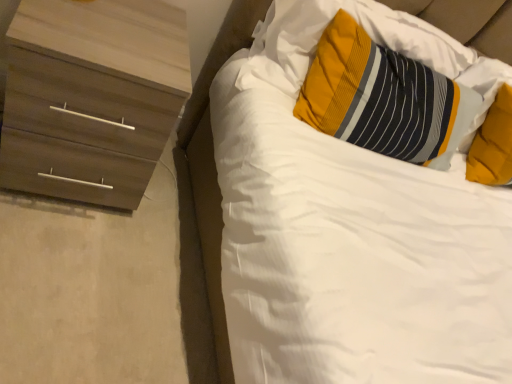
Question: From the image's perspective, is soft yellow pillow at upper right, which appears as the second pillow when viewed from the left, under striped fabric pillow at upper right, the second pillow when ordered from right to left?

Choices:
 (A) yes
 (B) no

Answer: (A)

Question: Is soft yellow pillow at upper right, marked as the first pillow in a right-to-left arrangement, shorter than striped fabric pillow at upper right, which appears as the 1th pillow when viewed from the left?

Choices:
 (A) no
 (B) yes

Answer: (A)

Question: Can you confirm if soft yellow pillow at upper right, marked as the first pillow in a right-to-left arrangement, is bigger than striped fabric pillow at upper right, the second pillow when ordered from right to left?

Choices:
 (A) yes
 (B) no

Answer: (B)

Question: Is soft yellow pillow at upper right, which appears as the second pillow when viewed from the left, smaller than striped fabric pillow at upper right, the second pillow when ordered from right to left?

Choices:
 (A) no
 (B) yes

Answer: (B)

Question: Does soft yellow pillow at upper right, marked as the first pillow in a right-to-left arrangement, contain striped fabric pillow at upper right, the second pillow when ordered from right to left?

Choices:
 (A) yes
 (B) no

Answer: (B)

Question: Is wooden chest of drawers at left in front of or behind white soft bed at upper right in the image?

Choices:
 (A) front
 (B) behind

Answer: (B)

Question: In terms of size, does wooden chest of drawers at left appear bigger or smaller than white soft bed at upper right?

Choices:
 (A) small
 (B) big

Answer: (A)

Question: Visually, is wooden chest of drawers at left positioned to the left or to the right of white soft bed at upper right?

Choices:
 (A) left
 (B) right

Answer: (A)

Question: From a real-world perspective, is wooden chest of drawers at left positioned above or below white soft bed at upper right?

Choices:
 (A) above
 (B) below

Answer: (B)

Question: From a real-world perspective, is white soft bed at upper right positioned above or below soft yellow pillow at upper right, marked as the first pillow in a right-to-left arrangement?

Choices:
 (A) above
 (B) below

Answer: (B)

Question: From the image's perspective, relative to soft yellow pillow at upper right, marked as the first pillow in a right-to-left arrangement, is white soft bed at upper right above or below?

Choices:
 (A) below
 (B) above

Answer: (A)

Question: Based on their positions, is white soft bed at upper right located to the left or right of soft yellow pillow at upper right, marked as the first pillow in a right-to-left arrangement?

Choices:
 (A) right
 (B) left

Answer: (B)

Question: Considering the positions of white soft bed at upper right and soft yellow pillow at upper right, marked as the first pillow in a right-to-left arrangement, in the image, is white soft bed at upper right wider or thinner than soft yellow pillow at upper right, marked as the first pillow in a right-to-left arrangement,?

Choices:
 (A) thin
 (B) wide

Answer: (B)

Question: From a real-world perspective, is wooden chest of drawers at left positioned above or below striped fabric pillow at upper right, which appears as the 1th pillow when viewed from the left?

Choices:
 (A) above
 (B) below

Answer: (B)

Question: Does point (155, 81) appear closer or farther from the camera than point (456, 135)?

Choices:
 (A) farther
 (B) closer

Answer: (B)